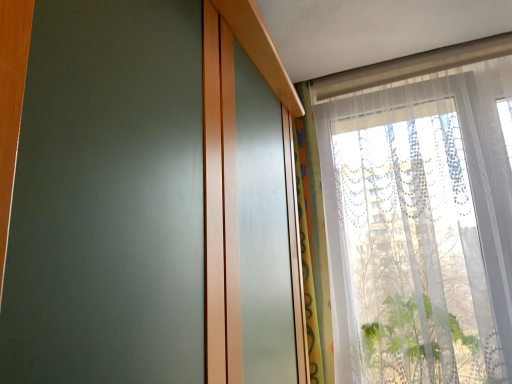
Question: Considering the relative sizes of translucent fabric curtain at upper right and transparent lace curtain at upper right in the image provided, is translucent fabric curtain at upper right shorter than transparent lace curtain at upper right?

Choices:
 (A) no
 (B) yes

Answer: (A)

Question: Is transparent lace curtain at upper right at the back of translucent fabric curtain at upper right?

Choices:
 (A) yes
 (B) no

Answer: (B)

Question: Is translucent fabric curtain at upper right smaller than transparent lace curtain at upper right?

Choices:
 (A) no
 (B) yes

Answer: (B)

Question: From the image's perspective, would you say translucent fabric curtain at upper right is positioned over transparent lace curtain at upper right?

Choices:
 (A) yes
 (B) no

Answer: (B)

Question: Is translucent fabric curtain at upper right to the left of transparent lace curtain at upper right from the viewer's perspective?

Choices:
 (A) yes
 (B) no

Answer: (A)

Question: Is translucent fabric curtain at upper right outside of transparent lace curtain at upper right?

Choices:
 (A) no
 (B) yes

Answer: (B)

Question: Is transparent lace curtain at upper right taller than translucent fabric curtain at upper right?

Choices:
 (A) yes
 (B) no

Answer: (B)

Question: Is transparent lace curtain at upper right positioned beyond the bounds of translucent fabric curtain at upper right?

Choices:
 (A) yes
 (B) no

Answer: (A)

Question: Considering the relative positions of transparent lace curtain at upper right and translucent fabric curtain at upper right in the image provided, is transparent lace curtain at upper right to the left of translucent fabric curtain at upper right from the viewer's perspective?

Choices:
 (A) no
 (B) yes

Answer: (A)

Question: Is transparent lace curtain at upper right facing away from translucent fabric curtain at upper right?

Choices:
 (A) no
 (B) yes

Answer: (A)

Question: From a real-world perspective, is transparent lace curtain at upper right on top of translucent fabric curtain at upper right?

Choices:
 (A) no
 (B) yes

Answer: (A)

Question: Is the position of transparent lace curtain at upper right more distant than that of translucent fabric curtain at upper right?

Choices:
 (A) no
 (B) yes

Answer: (A)

Question: Is translucent fabric curtain at upper right taller or shorter than transparent lace curtain at upper right?

Choices:
 (A) short
 (B) tall

Answer: (B)